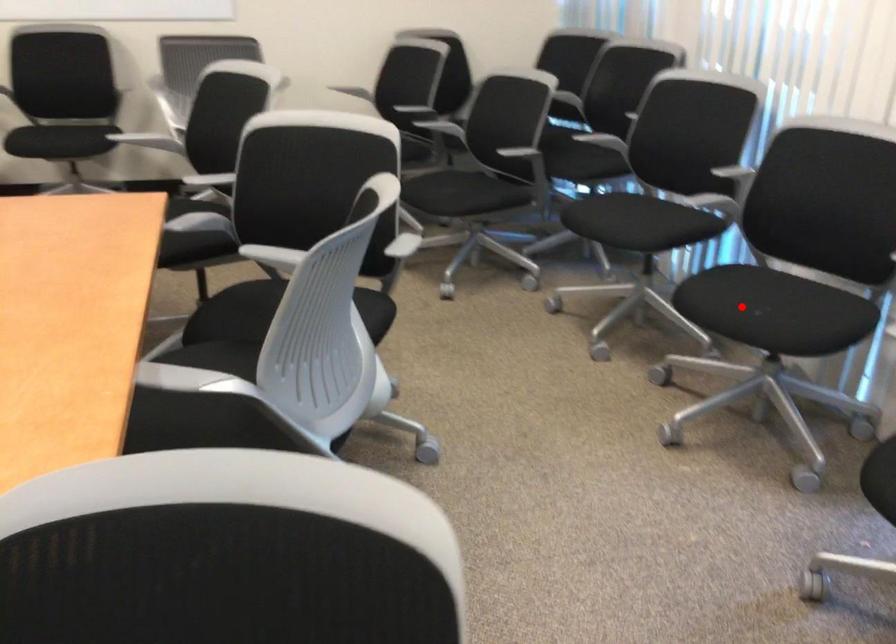
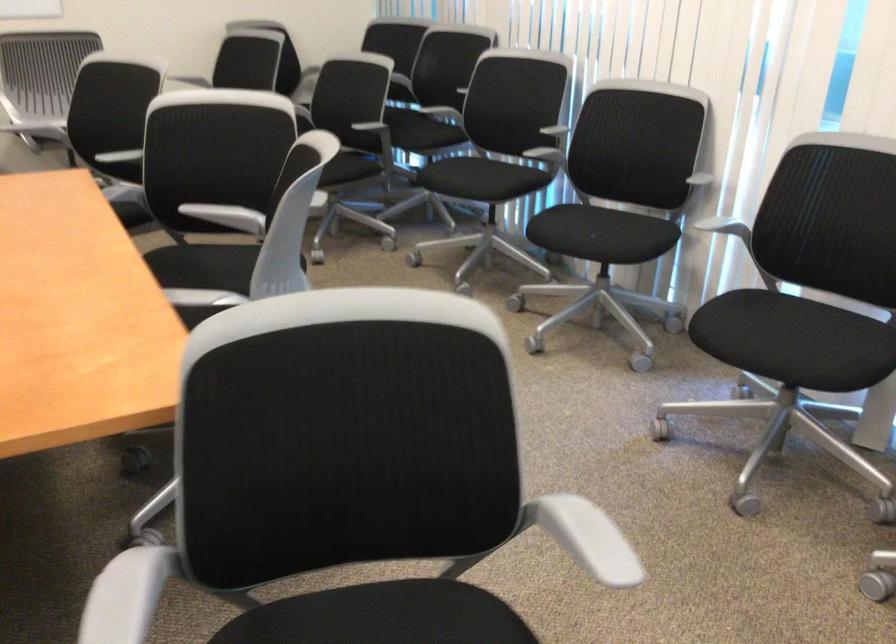
The point at the highlighted location is marked in the first image. Where is the corresponding point in the second image?

(582, 232)